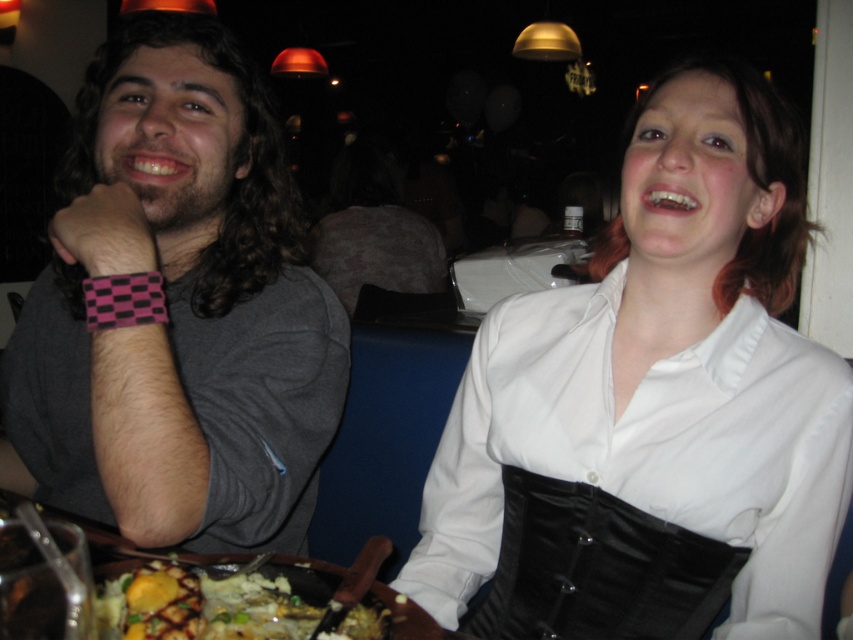
The height and width of the screenshot is (640, 853). What do you see at coordinates (665, 371) in the screenshot?
I see `white matte shirt at upper right` at bounding box center [665, 371].

Is point (610, 419) behind point (201, 458)?

That is True.

This screenshot has width=853, height=640. I want to click on white matte shirt at upper right, so click(665, 371).

Is point (726, 452) less distant than point (170, 604)?

No, (726, 452) is behind (170, 604).

Is white matte shirt at upper right further to the viewer compared to golden mashed potatoes at lower center?

Yes.

Does point (630, 141) lie in front of point (119, 602)?

No, it is not.

Identify the location of white matte shirt at upper right. The width and height of the screenshot is (853, 640). (665, 371).

Between golden mashed potatoes at lower center and wooden table at lower center, which one is positioned higher?

Positioned higher is golden mashed potatoes at lower center.

Is point (209, 576) positioned in front of point (213, 568)?

Yes, it is.

At what (x,y) coordinates should I click in order to perform the action: click on golden mashed potatoes at lower center. Please return your answer as a coordinate pair (x, y). Looking at the image, I should click on (221, 608).